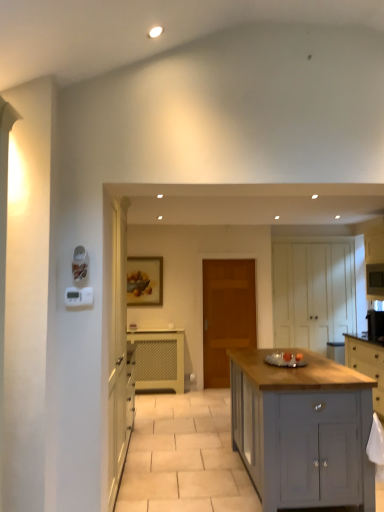
Question: Considering the positions of point (377, 227) and point (225, 324), is point (377, 227) closer or farther from the camera than point (225, 324)?

Choices:
 (A) farther
 (B) closer

Answer: (B)

Question: Considering the positions of white matte cabinet at right, which ranks as the third cabinetry in front-to-back order, and wooden door at center in the image, is white matte cabinet at right, which ranks as the third cabinetry in front-to-back order, taller or shorter than wooden door at center?

Choices:
 (A) tall
 (B) short

Answer: (B)

Question: Considering the real-world distances, which object is closest to the matte gray cabinet at center, the 2th cabinetry when ordered from left to right?

Choices:
 (A) white glossy microwave at upper right
 (B) white matte cabinet at right, the fifth cabinetry in the left-to-right sequence
 (C) white wood cabinet at center, which is the 3th cabinetry from left to right
 (D) beige mesh radiator at center, which is the 2th cabinetry in back-to-front order
 (E) light gray wood cabinet at right, placed as the second cabinetry when sorted from front to back

Answer: (E)

Question: Which is nearer to the matte gray cabinet at center, the 4th cabinetry from the right?

Choices:
 (A) beige mesh radiator at center, which is the 2th cabinetry in back-to-front order
 (B) white matte cabinet at right, which ranks as the third cabinetry in front-to-back order
 (C) white wood cabinet at center, the first cabinetry in the back-to-front sequence
 (D) white glossy microwave at upper right
 (E) light gray wood cabinet at right, placed as the second cabinetry when sorted from front to back

Answer: (E)